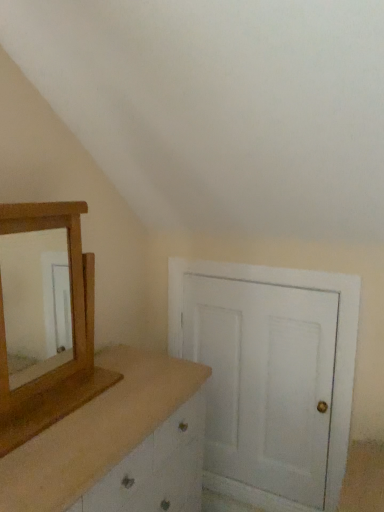
Question: Is white matte door at center far away from wooden mirror at left?

Choices:
 (A) no
 (B) yes

Answer: (A)

Question: Does white matte door at center have a larger size compared to wooden mirror at left?

Choices:
 (A) no
 (B) yes

Answer: (A)

Question: Is white matte door at center behind wooden mirror at left?

Choices:
 (A) yes
 (B) no

Answer: (A)

Question: From a real-world perspective, is white matte door at center below wooden mirror at left?

Choices:
 (A) no
 (B) yes

Answer: (B)

Question: Is wooden mirror at left at the back of white matte door at center?

Choices:
 (A) no
 (B) yes

Answer: (A)

Question: Is white matte door at center smaller than wooden mirror at left?

Choices:
 (A) no
 (B) yes

Answer: (B)

Question: Can you confirm if wooden mirror at left is wider than wooden dresser at left?

Choices:
 (A) yes
 (B) no

Answer: (B)

Question: Does wooden mirror at left come behind wooden dresser at left?

Choices:
 (A) yes
 (B) no

Answer: (A)

Question: Is wooden mirror at left smaller than wooden dresser at left?

Choices:
 (A) no
 (B) yes

Answer: (B)

Question: Does wooden mirror at left have a greater height compared to wooden dresser at left?

Choices:
 (A) no
 (B) yes

Answer: (A)

Question: Can you confirm if wooden mirror at left is shorter than wooden dresser at left?

Choices:
 (A) yes
 (B) no

Answer: (A)

Question: Is wooden mirror at left facing away from wooden dresser at left?

Choices:
 (A) yes
 (B) no

Answer: (B)

Question: Can you confirm if wooden mirror at left is thinner than white matte door at center?

Choices:
 (A) yes
 (B) no

Answer: (B)